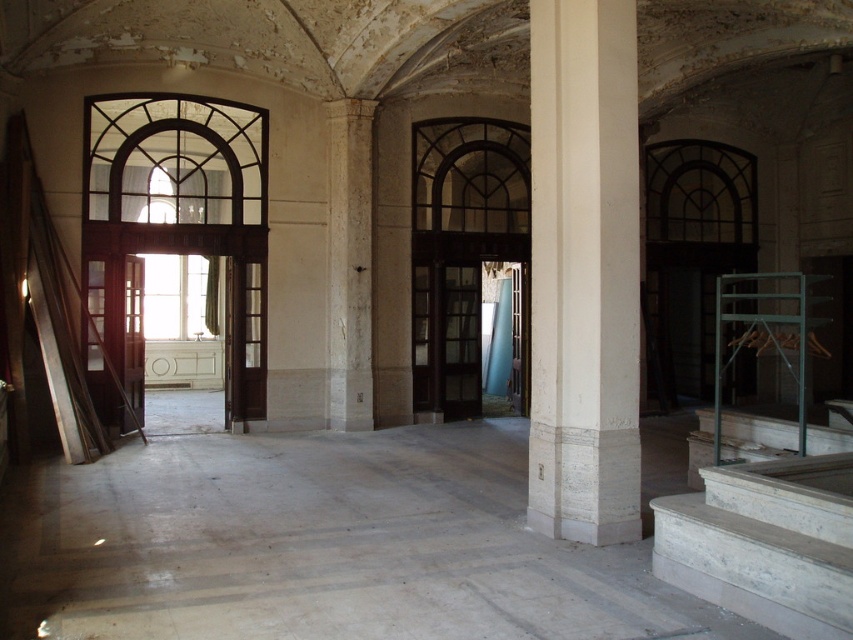
You are standing in the grand interior space and notice two points marked in the scene. The first point is at coordinates point (544, 19) and the second is at point (811, 518). Which point is closer to you?

Point (544, 19) is further to the viewer than point (811, 518), so the second point is closer to you.

You are an architect assessing the structural integrity of the space. You notice the white marble column at center and the white marble stairs at lower right. Which of these two objects has a smaller diameter?

The white marble column at center has a smaller diameter than the white marble stairs at lower right.

What is located at the coordinates point (584, 272) in the image?

The white marble column at center is located at point (584, 272).